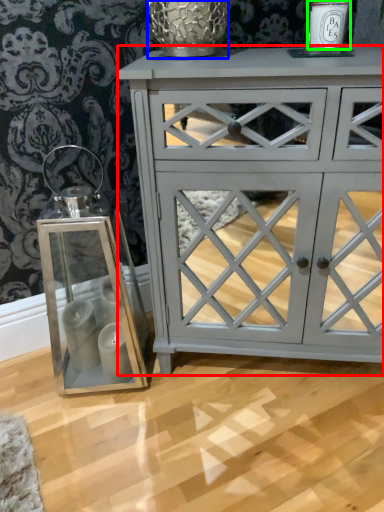
Question: Estimate the real-world distances between objects in this image. Which object is farther from chest of drawers (highlighted by a red box), glass vase (highlighted by a blue box) or candle holder (highlighted by a green box)?

Choices:
 (A) glass vase
 (B) candle holder

Answer: (B)